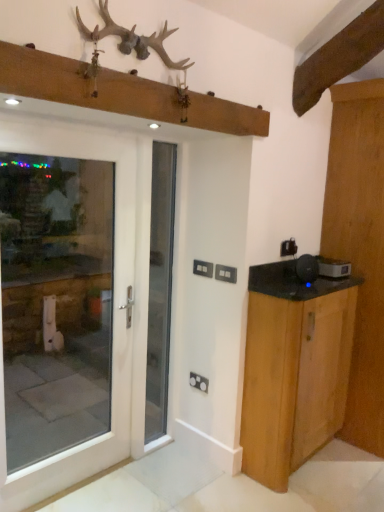
What are the coordinates of `free point above white glass door at left, which appears as the 1th door when viewed from the left (from a real-world perspective)` in the screenshot? It's located at (72, 130).